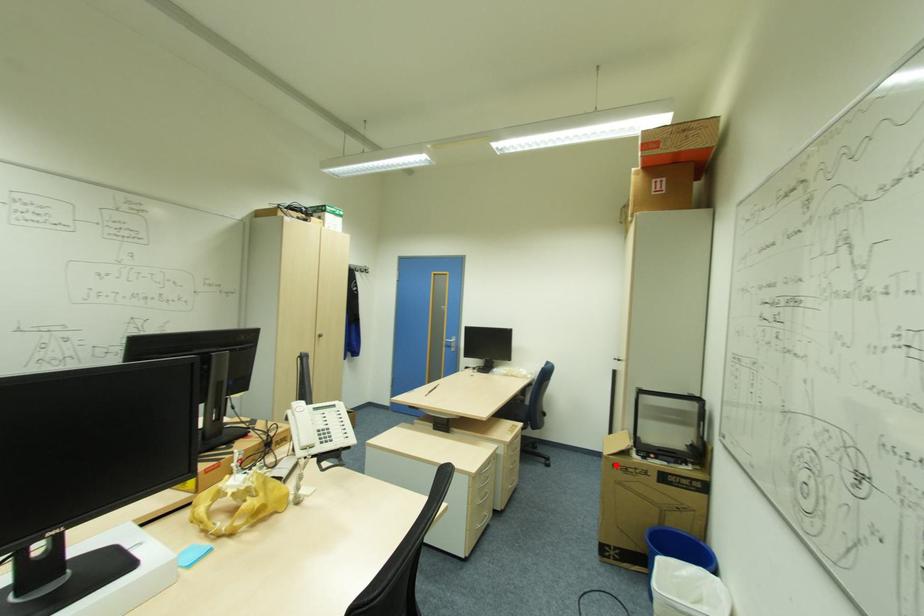
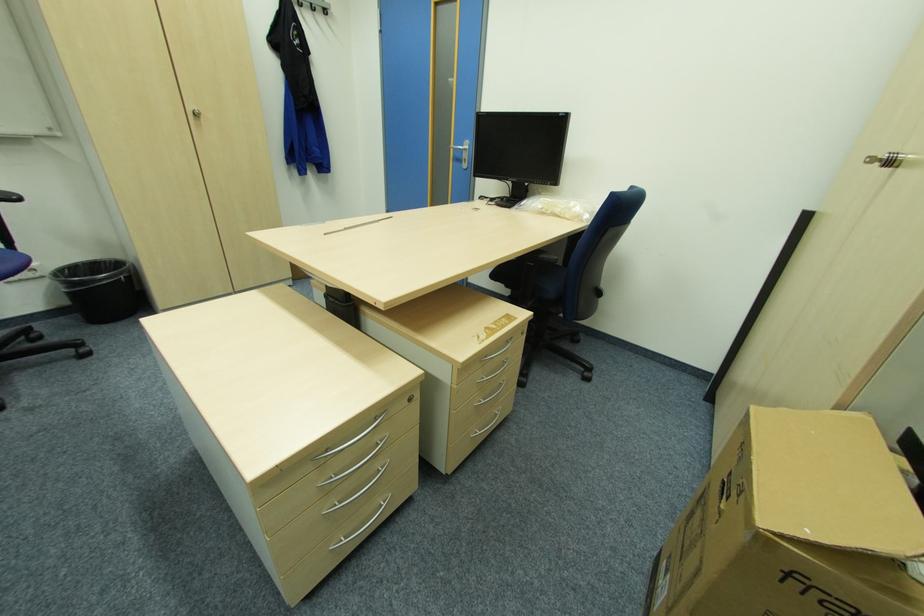
The point at the highlighted location is marked in the first image. Where is the corresponding point in the second image?

(789, 573)